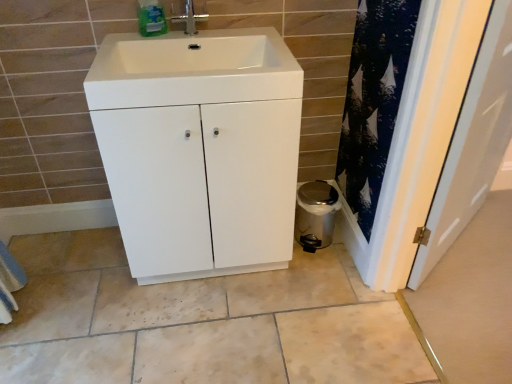
Question: Is white glossy sink at center taller than metallic trash can at lower right?

Choices:
 (A) no
 (B) yes

Answer: (A)

Question: Is white glossy sink at center placed right next to metallic trash can at lower right?

Choices:
 (A) no
 (B) yes

Answer: (A)

Question: From the image's perspective, does white glossy sink at center appear higher than metallic trash can at lower right?

Choices:
 (A) yes
 (B) no

Answer: (A)

Question: From the image's perspective, would you say white glossy sink at center is shown under metallic trash can at lower right?

Choices:
 (A) yes
 (B) no

Answer: (B)

Question: Is white glossy sink at center located outside metallic trash can at lower right?

Choices:
 (A) yes
 (B) no

Answer: (A)

Question: Is point click(442, 167) positioned closer to the camera than point click(153, 11)?

Choices:
 (A) farther
 (B) closer

Answer: (B)

Question: Is white glossy door at right wider or thinner than green plastic bottle at upper center?

Choices:
 (A) thin
 (B) wide

Answer: (A)

Question: Considering the positions of white glossy door at right and green plastic bottle at upper center in the image, is white glossy door at right taller or shorter than green plastic bottle at upper center?

Choices:
 (A) tall
 (B) short

Answer: (A)

Question: Considering their positions, is white glossy door at right located in front of or behind green plastic bottle at upper center?

Choices:
 (A) behind
 (B) front

Answer: (B)

Question: Considering the positions of metallic trash can at lower right and silver metallic tap at upper center in the image, is metallic trash can at lower right taller or shorter than silver metallic tap at upper center?

Choices:
 (A) short
 (B) tall

Answer: (B)

Question: Is point pyautogui.click(x=320, y=211) positioned closer to the camera than point pyautogui.click(x=188, y=8)?

Choices:
 (A) closer
 (B) farther

Answer: (B)

Question: From the image's perspective, is metallic trash can at lower right positioned above or below silver metallic tap at upper center?

Choices:
 (A) above
 (B) below

Answer: (B)

Question: Based on their sizes in the image, would you say metallic trash can at lower right is bigger or smaller than silver metallic tap at upper center?

Choices:
 (A) small
 (B) big

Answer: (B)

Question: Does point (161, 62) appear closer or farther from the camera than point (145, 0)?

Choices:
 (A) farther
 (B) closer

Answer: (A)

Question: In the image, is white matte cabinet at center positioned in front of or behind green plastic bottle at upper center?

Choices:
 (A) front
 (B) behind

Answer: (A)